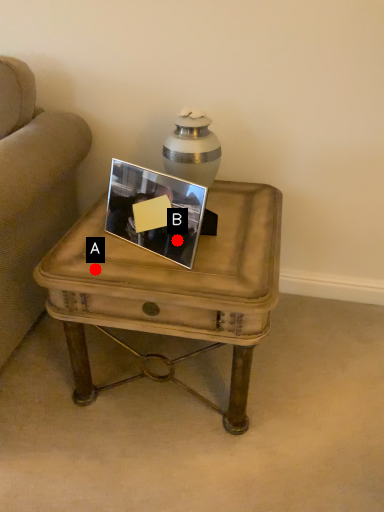
Question: Two points are circled on the image, labeled by A and B beside each circle. Among these points, which one is nearest to the camera?

Choices:
 (A) A is closer
 (B) B is closer

Answer: (A)